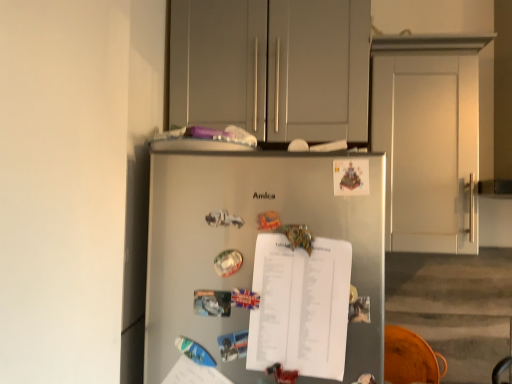
Question: Should I look upward or downward to see satin silver refrigerator at center?

Choices:
 (A) up
 (B) down

Answer: (B)

Question: Can you confirm if orange wood swivel chair at lower right is wider than satin silver refrigerator at center?

Choices:
 (A) yes
 (B) no

Answer: (B)

Question: Is orange wood swivel chair at lower right turned away from satin silver refrigerator at center?

Choices:
 (A) yes
 (B) no

Answer: (B)

Question: Is orange wood swivel chair at lower right outside satin silver refrigerator at center?

Choices:
 (A) yes
 (B) no

Answer: (A)

Question: Is the position of orange wood swivel chair at lower right less distant than that of satin silver refrigerator at center?

Choices:
 (A) no
 (B) yes

Answer: (A)

Question: Is orange wood swivel chair at lower right at the left side of satin silver refrigerator at center?

Choices:
 (A) no
 (B) yes

Answer: (A)

Question: Is satin silver refrigerator at center completely or partially inside orange wood swivel chair at lower right?

Choices:
 (A) yes
 (B) no

Answer: (B)

Question: Does white paper at center have a greater width compared to matte gray cabinets at upper center?

Choices:
 (A) no
 (B) yes

Answer: (A)

Question: Considering the relative sizes of white paper at center and matte gray cabinets at upper center in the image provided, is white paper at center shorter than matte gray cabinets at upper center?

Choices:
 (A) no
 (B) yes

Answer: (B)

Question: Considering the relative sizes of white paper at center and matte gray cabinets at upper center in the image provided, is white paper at center bigger than matte gray cabinets at upper center?

Choices:
 (A) yes
 (B) no

Answer: (B)

Question: Is white paper at center facing towards matte gray cabinets at upper center?

Choices:
 (A) yes
 (B) no

Answer: (B)

Question: Would you say white paper at center contains matte gray cabinets at upper center?

Choices:
 (A) yes
 (B) no

Answer: (B)

Question: Is the position of white paper at center less distant than that of matte gray cabinets at upper center?

Choices:
 (A) no
 (B) yes

Answer: (B)

Question: Does matte gray cabinets at upper center have a greater width compared to orange wood swivel chair at lower right?

Choices:
 (A) no
 (B) yes

Answer: (B)